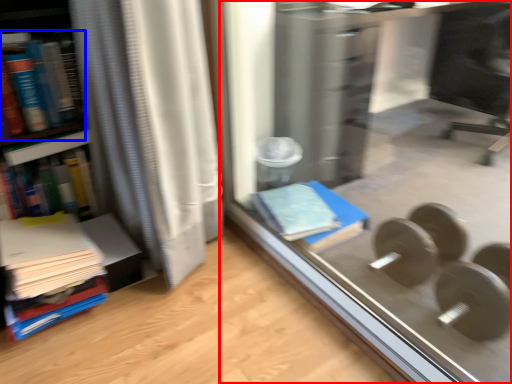
Question: Which of the following is the closest to the observer, glass door (highlighted by a red box) or book (highlighted by a blue box)?

Choices:
 (A) glass door
 (B) book

Answer: (A)